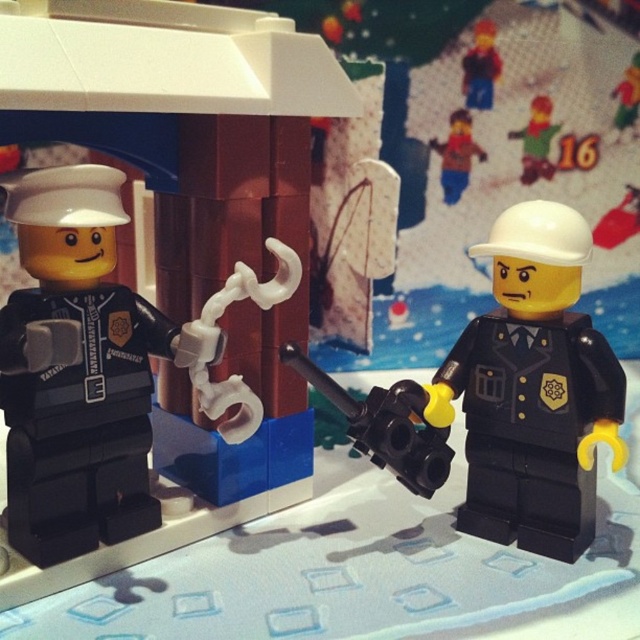
You are standing at the point labeled as point (113, 339) in the image. You want to pick up a LEGO minifigure that is exactly 30 inches away from you. Is there a LEGO minifigure within reach?

The distance between point (113, 339) and the viewer is 33.64 inches, which is greater than 30 inches. Therefore, there is no LEGO minifigure within reach at exactly 30 inches from the point labeled as point (113, 339).

You are a LEGO enthusiast trying to recreate this scene. You have both the matte black police officer at left and the matte brown figure at upper center. Which one should you place first to match the original arrangement?

You should place the matte brown figure at upper center first because the matte black police officer at left is positioned on the left side of it, meaning the brown figure is the central point around which the other is arranged.

Based on the photo, you are a LEGO collector trying to assemble a display. You have two items in front of you, the black plastic gun at center and the smooth plastic figure at upper center. Which item should you place on the lower shelf to ensure stability given their sizes?

The smooth plastic figure at upper center is shorter than the black plastic gun at center, so placing the smooth plastic figure at upper center on the lower shelf would ensure stability as it can support taller items above.